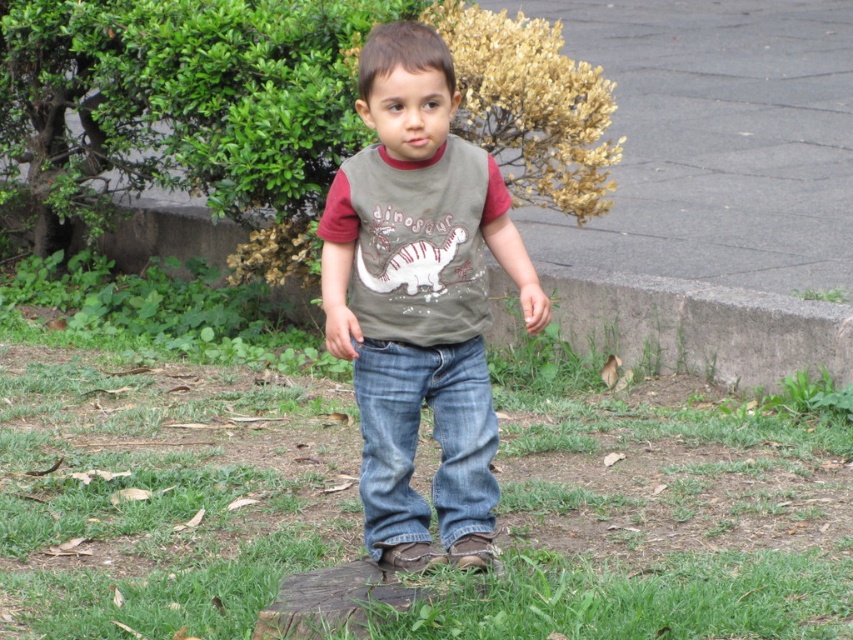
You are a drone operator trying to locate a specific point in an image. The image shows a child standing on grass near pavement. There is a point marked at coordinates (161, 474). According to the scene description, what does this point most likely represent?

The point at coordinates (161, 474) marks green grass at center.

You are a delivery robot that needs to deliver a package to the gray asphalt pavement at upper center. The denim jeans at center are blocking your path. Can you go around them since you are 1 meter wide?

The gray asphalt pavement at upper center is taller than denim jeans at center, so yes, the robot can go around the denim jeans at center by moving around them since the pavement is elevated.